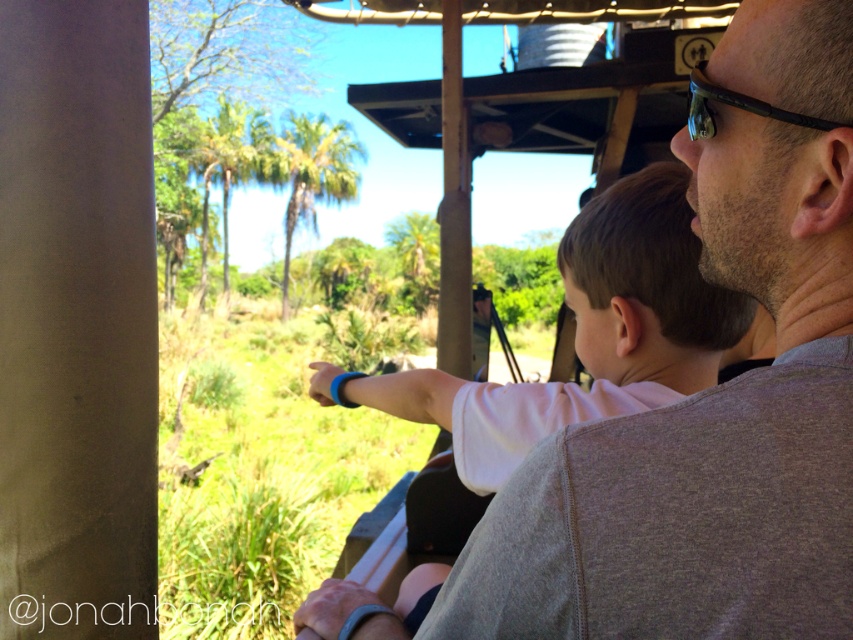
Question: Which point appears closest to the camera in this image?

Choices:
 (A) (764, 106)
 (B) (590, 419)

Answer: (A)

Question: Which of the following is the closest to the observer?

Choices:
 (A) black plastic sunglasses at upper right
 (B) white cotton shirt at center

Answer: (A)

Question: Can you confirm if white cotton shirt at center is smaller than black plastic sunglasses at upper right?

Choices:
 (A) yes
 (B) no

Answer: (B)

Question: Can you confirm if white cotton shirt at center is smaller than black plastic sunglasses at upper right?

Choices:
 (A) yes
 (B) no

Answer: (B)

Question: Observing the image, what is the correct spatial positioning of white cotton shirt at center in reference to black plastic sunglasses at upper right?

Choices:
 (A) above
 (B) below

Answer: (B)

Question: Among these objects, which one is farthest from the camera?

Choices:
 (A) white cotton shirt at center
 (B) black plastic sunglasses at upper right

Answer: (A)